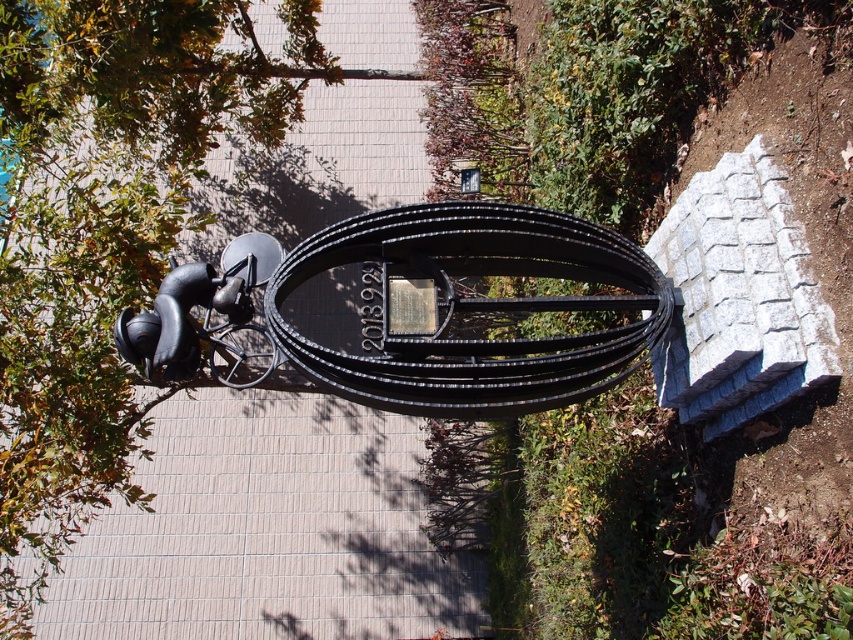
Is green leafy tree at upper left to the left of black metallic cable at center from the viewer's perspective?

Yes, green leafy tree at upper left is to the left of black metallic cable at center.

Can you confirm if green leafy tree at upper left is shorter than black metallic cable at center?

No, green leafy tree at upper left is not shorter than black metallic cable at center.

Find the location of a particular element. Image resolution: width=853 pixels, height=640 pixels. green leafy tree at upper left is located at coordinates (103, 228).